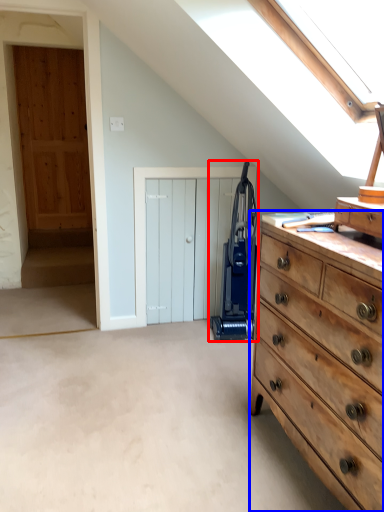
Question: Which of the following is the closest to the observer, appliance (highlighted by a red box) or chest of drawers (highlighted by a blue box)?

Choices:
 (A) appliance
 (B) chest of drawers

Answer: (B)